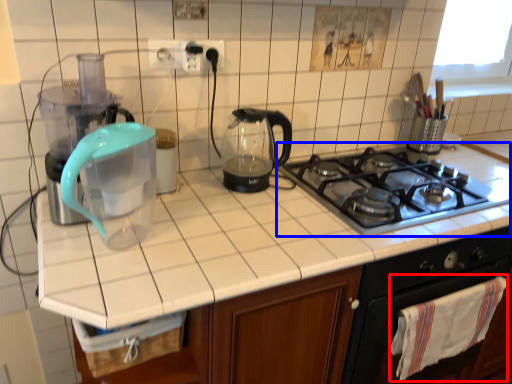
Question: Among these objects, which one is nearest to the camera, cloth (highlighted by a red box) or gas stove (highlighted by a blue box)?

Choices:
 (A) cloth
 (B) gas stove

Answer: (B)